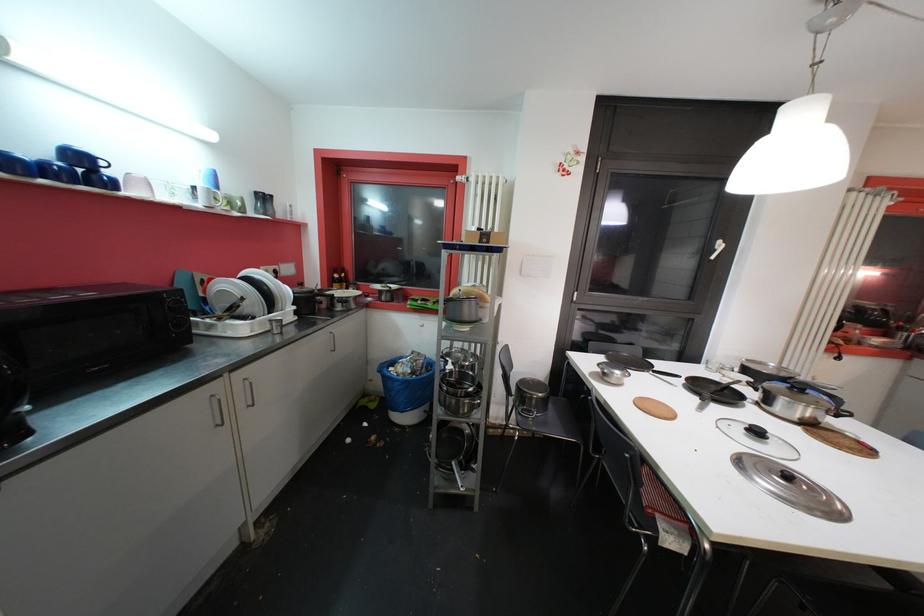
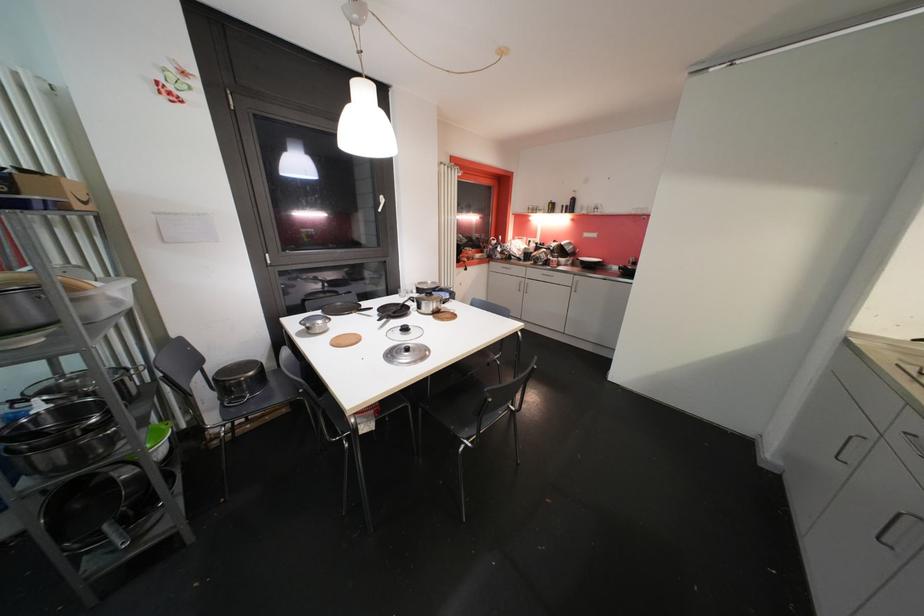
Question: The camera is either moving clockwise (left) or counter-clockwise (right) around the object. The first image is from the beginning of the video and the second image is from the end. Is the camera moving left or right when shooting the video?

Choices:
 (A) Left
 (B) Right

Answer: (A)